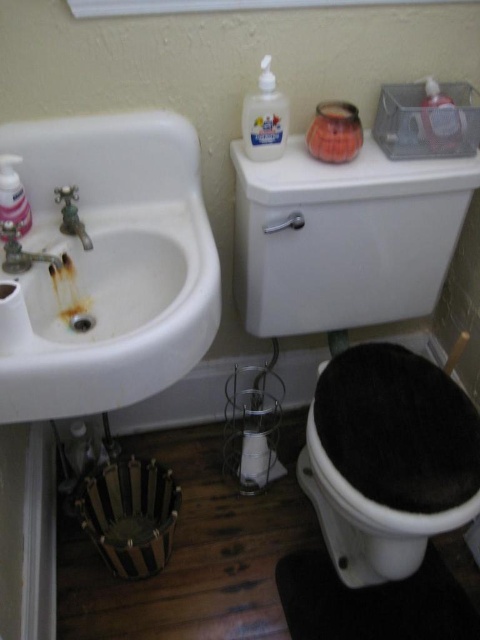
Is point (15, 172) positioned before point (16, 243)?

That is False.

Identify the location of translucent plastic soap dispenser at left. Image resolution: width=480 pixels, height=640 pixels. (12, 195).

Is point (16, 186) closer to viewer compared to point (0, 224)?

Yes, point (16, 186) is closer to viewer.

Where is `translucent plastic soap dispenser at left`? Image resolution: width=480 pixels, height=640 pixels. translucent plastic soap dispenser at left is located at coordinates (12, 195).

Is black fuzzy toilet bowl at lower right taller than clear plastic bottle at upper center?

Indeed, black fuzzy toilet bowl at lower right has a greater height compared to clear plastic bottle at upper center.

Where is `black fuzzy toilet bowl at lower right`? black fuzzy toilet bowl at lower right is located at coordinates (382, 467).

The width and height of the screenshot is (480, 640). Identify the location of black fuzzy toilet bowl at lower right. (382, 467).

Between point (116, 216) and point (12, 237), which one is positioned behind?

The point (116, 216) is behind.

Does white glossy sink at left have a smaller size compared to brushed metal faucet at sink left?

Actually, white glossy sink at left might be larger than brushed metal faucet at sink left.

This screenshot has width=480, height=640. Identify the location of white glossy sink at left. (108, 266).

You are a GUI agent. You are given a task and a screenshot of the screen. Output one action in this format:
    pyautogui.click(x=<x>, y=<y>)
    Task: Click on the white glossy sink at left
    
    Given the screenshot: What is the action you would take?
    pyautogui.click(x=108, y=266)